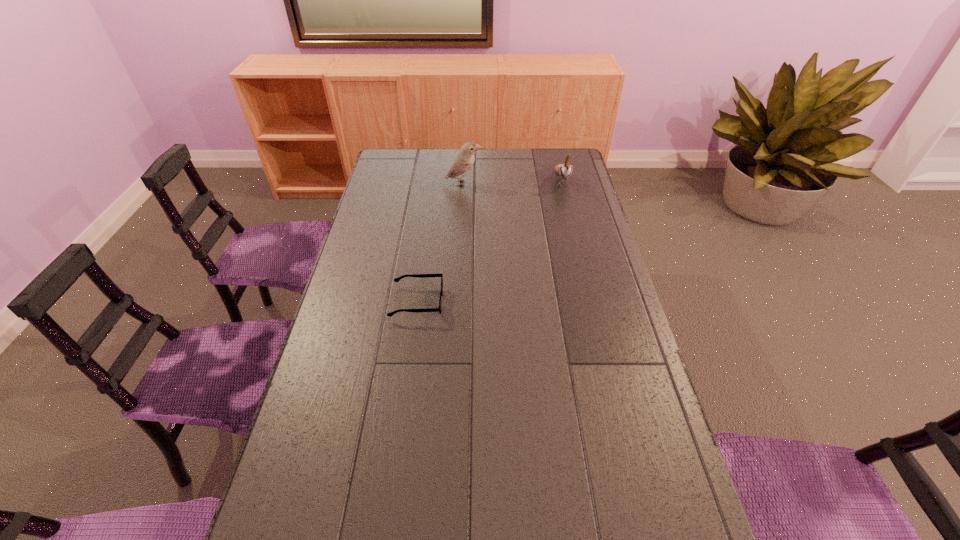
What are the coordinates of `free location that satisfies the following two spatial constraints: 1. at the face of the right bird; 2. at the face of the left bird` in the screenshot? It's located at (563, 184).

I want to click on vacant space that satisfies the following two spatial constraints: 1. at the face of the right bird; 2. at the face of the left bird, so click(x=563, y=184).

Identify the location of vacant area that satisfies the following two spatial constraints: 1. at the face of the right bird; 2. on the arms of the spectacles. (591, 302).

The width and height of the screenshot is (960, 540). I want to click on free region that satisfies the following two spatial constraints: 1. at the face of the rightmost object; 2. at the face of the left bird, so point(563,184).